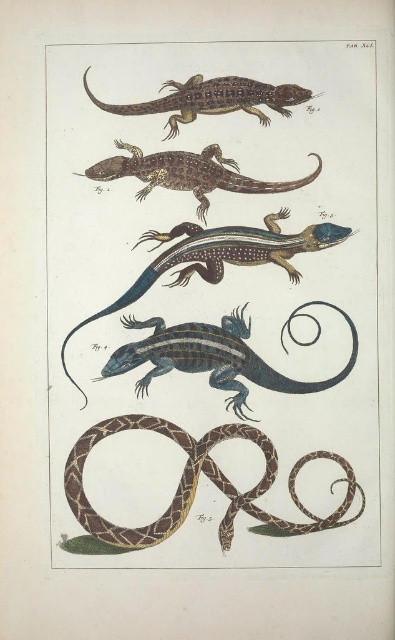
Based on the illustration from the scientific book, which of the two reptiles, the brown textured snake at center or the brown textured lizard at upper center, has a smaller height?

The brown textured snake at center has a lesser height compared to the brown textured lizard at upper center.

In the illustration labeled Fig. 1 and Fig. 2, there are two lizards. The first is a blue glossy lizard at center and the second is a brown textured lizard at upper center. Which of these two lizards is wider?

The blue glossy lizard at center is wider than the brown textured lizard at upper center.